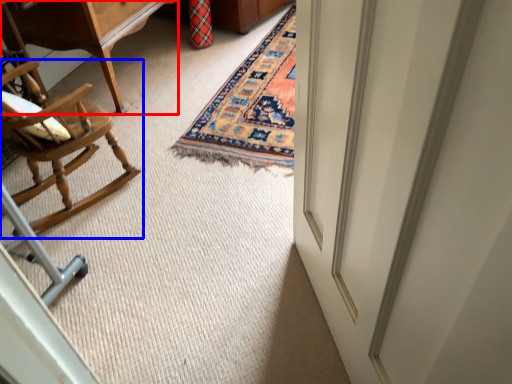
Question: Which object appears closest to the camera in this image, table (highlighted by a red box) or chair (highlighted by a blue box)?

Choices:
 (A) table
 (B) chair

Answer: (B)